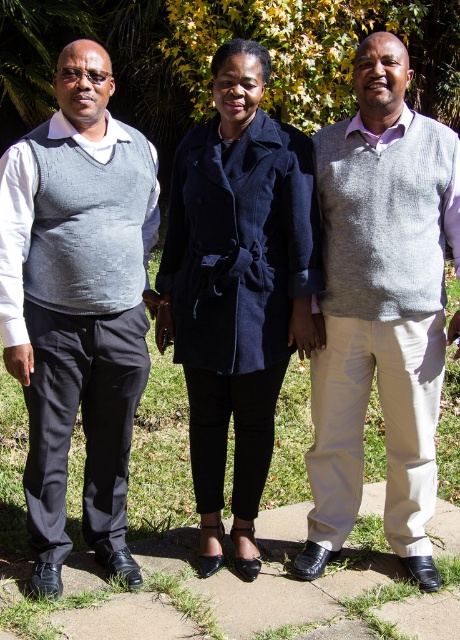
Between matte gray sweater vest at left and velvet black coat at center, which one has more height?

velvet black coat at center is taller.

Does matte gray sweater vest at left appear under velvet black coat at center?

Yes, matte gray sweater vest at left is below velvet black coat at center.

Identify the location of matte gray sweater vest at left. (78, 305).

Identify the location of matte gray sweater vest at left. (78, 305).

Who is higher up, matte gray sweater vest at left or grey knitted vest at center?

grey knitted vest at center

Does matte gray sweater vest at left have a larger size compared to grey knitted vest at center?

Indeed, matte gray sweater vest at left has a larger size compared to grey knitted vest at center.

Does point (144, 294) lie behind point (430, 445)?

Yes.

Identify the location of matte gray sweater vest at left. This screenshot has width=460, height=640. (78, 305).

Can you confirm if grey knitted vest at center is smaller than velvet black coat at center?

Yes, grey knitted vest at center is smaller than velvet black coat at center.

Between grey knitted vest at center and velvet black coat at center, which one has more height?

With more height is grey knitted vest at center.

Measure the distance between point (412, 120) and camera.

Point (412, 120) is 2.98 meters from camera.

This screenshot has height=640, width=460. Find the location of `grey knitted vest at center`. grey knitted vest at center is located at coordinates (380, 308).